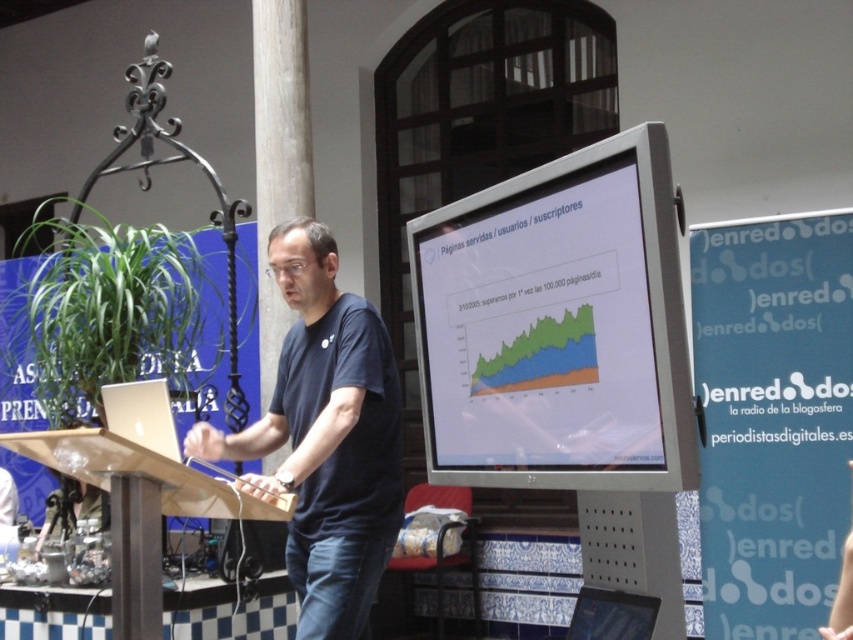
Find the location of a particular element. This screenshot has width=853, height=640. blue glossy projection screen at center is located at coordinates (772, 419).

Which of these two, blue glossy projection screen at center or wooden podium at center, stands taller?

blue glossy projection screen at center

Which is behind, point (705, 326) or point (70, 454)?

Positioned behind is point (705, 326).

Find the location of `blue glossy projection screen at center`. blue glossy projection screen at center is located at coordinates (772, 419).

Can you confirm if matte plastic monitor at center is positioned below dark blue t-shirt at center?

No.

The image size is (853, 640). What are the coordinates of `matte plastic monitor at center` in the screenshot? It's located at (556, 326).

Measure the distance between point (628, 180) and camera.

Point (628, 180) and camera are 7.41 feet apart.

Identify the location of matte plastic monitor at center. (556, 326).

Between matte plastic monitor at center and blue glossy projection screen at center, which one is positioned lower?

blue glossy projection screen at center is below.

Between matte plastic monitor at center and blue glossy projection screen at center, which one appears on the left side from the viewer's perspective?

matte plastic monitor at center is more to the left.

The height and width of the screenshot is (640, 853). What do you see at coordinates (556, 326) in the screenshot? I see `matte plastic monitor at center` at bounding box center [556, 326].

Identify the location of matte plastic monitor at center. The image size is (853, 640). (556, 326).